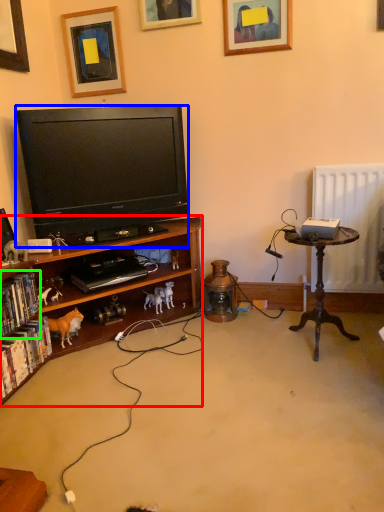
Question: Which object is the closest to the bookcase (highlighted by a red box)? Choose among these: television (highlighted by a blue box) or book (highlighted by a green box).

Choices:
 (A) television
 (B) book

Answer: (A)